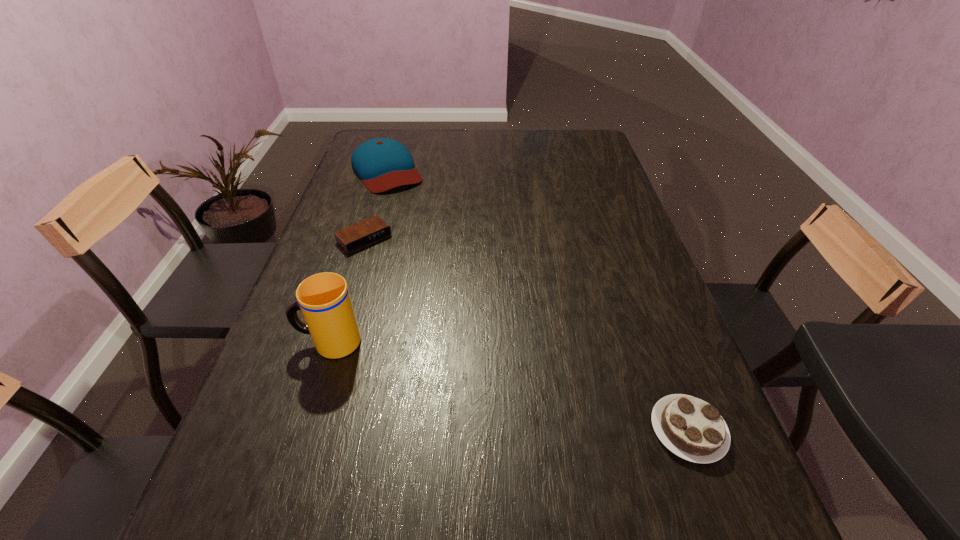
Identify the location of cup. (324, 299).

Identify the location of the tallest object. (324, 299).

You are a GUI agent. You are given a task and a screenshot of the screen. Output one action in this format:
    pyautogui.click(x=<x>, y=<y>)
    Task: Click on the rightmost object
    The height and width of the screenshot is (540, 960).
    Given the screenshot: What is the action you would take?
    pyautogui.click(x=691, y=428)

Locate an element on the screen. The width and height of the screenshot is (960, 540). the third tallest object is located at coordinates (691, 428).

This screenshot has height=540, width=960. What are the coordinates of `the shortest object` in the screenshot? It's located at (359, 235).

The image size is (960, 540). Find the location of `alarm clock`. alarm clock is located at coordinates (359, 235).

At what (x,y) coordinates should I click in order to perform the action: click on the farthest object. Please return your answer as a coordinate pair (x, y). This screenshot has width=960, height=540. Looking at the image, I should click on (382, 164).

You are a GUI agent. You are given a task and a screenshot of the screen. Output one action in this format:
    pyautogui.click(x=<x>, y=<y>)
    Task: Click on the baseball cap
    This screenshot has height=540, width=960.
    Given the screenshot: What is the action you would take?
    pyautogui.click(x=382, y=164)

The height and width of the screenshot is (540, 960). Identify the location of blank space located on the side of the tallest object with the handle. (276, 342).

At what (x,y) coordinates should I click in order to perform the action: click on free space located 0.280m on the back of the chocolate cake. Please return your answer as a coordinate pair (x, y). Looking at the image, I should click on (639, 298).